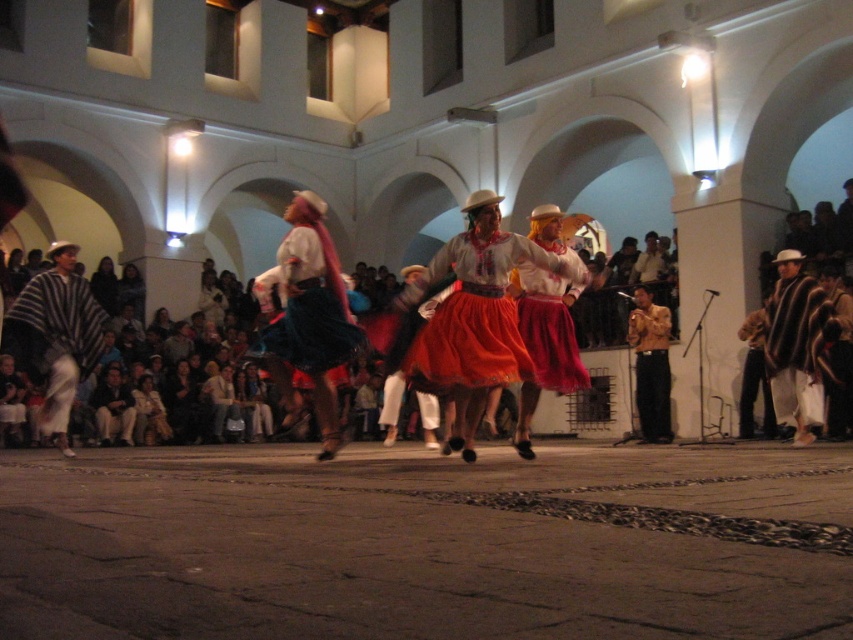
Can you confirm if matte orange skirt at center is positioned to the right of matte red skirt at center?

Indeed, matte orange skirt at center is positioned on the right side of matte red skirt at center.

Who is taller, matte orange skirt at center or matte red skirt at center?

matte orange skirt at center is taller.

Image resolution: width=853 pixels, height=640 pixels. Identify the location of matte orange skirt at center. (477, 312).

Is matte orange skirt at center thinner than matte black dress at center?

Incorrect, matte orange skirt at center's width is not less than matte black dress at center's.

In the scene shown: Does matte orange skirt at center appear under matte black dress at center?

Incorrect, matte orange skirt at center is not positioned below matte black dress at center.

Describe the element at coordinates (477, 312) in the screenshot. Image resolution: width=853 pixels, height=640 pixels. I see `matte orange skirt at center` at that location.

I want to click on matte orange skirt at center, so click(477, 312).

Looking at this image, does matte black dress at center appear on the left side of matte blue skirt at center?

Incorrect, matte black dress at center is not on the left side of matte blue skirt at center.

Does matte black dress at center appear under matte blue skirt at center?

Yes.

Which is behind, point (173, 432) or point (102, 292)?

The point (102, 292) is behind.

Locate an element on the screen. matte black dress at center is located at coordinates (183, 404).